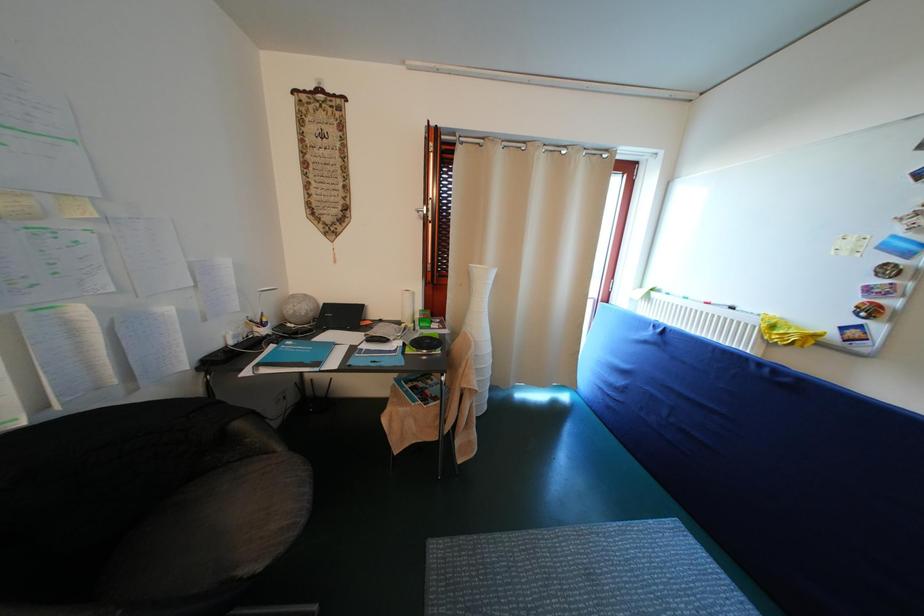
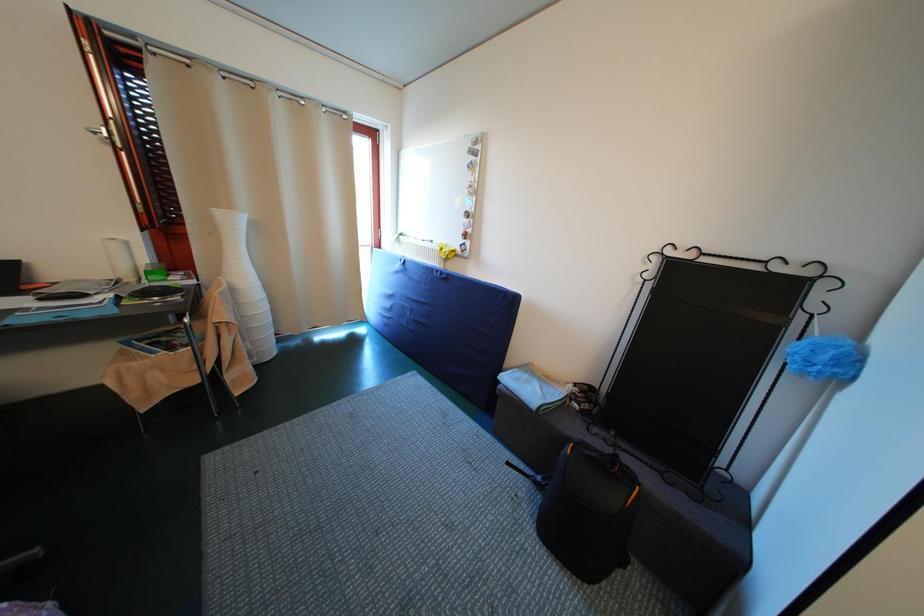
Question: The images are taken continuously from a first-person perspective. In which direction is your viewpoint rotating?

Choices:
 (A) Left
 (B) Right
 (C) Up
 (D) Down

Answer: (B)